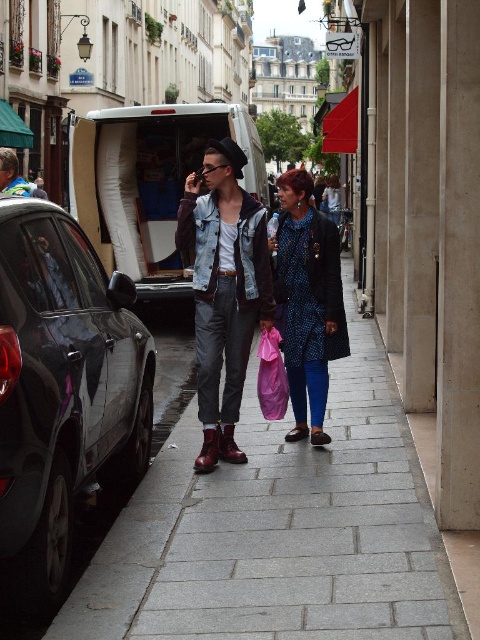
You are a pedestrian standing on the sidewalk in the scene. You notice a white matte van at center and a blue dotted dress at center. Which object is positioned to the left of the other?

The white matte van at center is to the left of the blue dotted dress at center.

You are a photographer standing at the camera position. You want to take a photo of the matte leather jacket at center. Is the jacket within your camera range? The camera can capture objects up to 60 feet away.

The matte leather jacket at center and camera are 60.60 feet apart, which exceeds the camera range of 60 feet. Therefore, the jacket is slightly out of range and cannot be captured clearly.

You are a fashion designer observing the urban street scene. You notice a matte leather jacket at center. Can you determine its exact position in the image using the coordinate system provided?

The matte leather jacket at center is located at point coordinates of (224, 291).